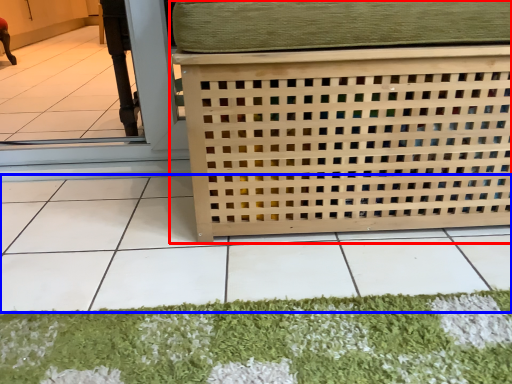
Question: Which point is further to the camera, furniture (highlighted by a red box) or tile (highlighted by a blue box)?

Choices:
 (A) furniture
 (B) tile

Answer: (A)